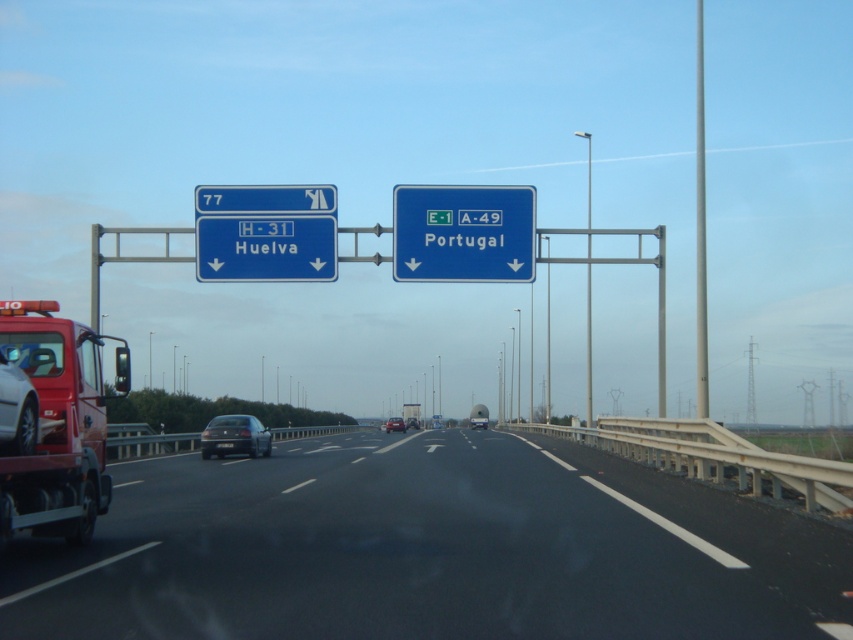
You are driving on the highway and see the metallic red truck at center and the black plastic license plate at center. Which object is closer to the road surface?

The metallic red truck at center is closer to the road surface than the black plastic license plate at center because the truck is positioned below the license plate.

What is the location of the point with coordinates [265,248] in the highway scene?

The point with coordinates [265,248] corresponds to the blue metallic sign at upper center.